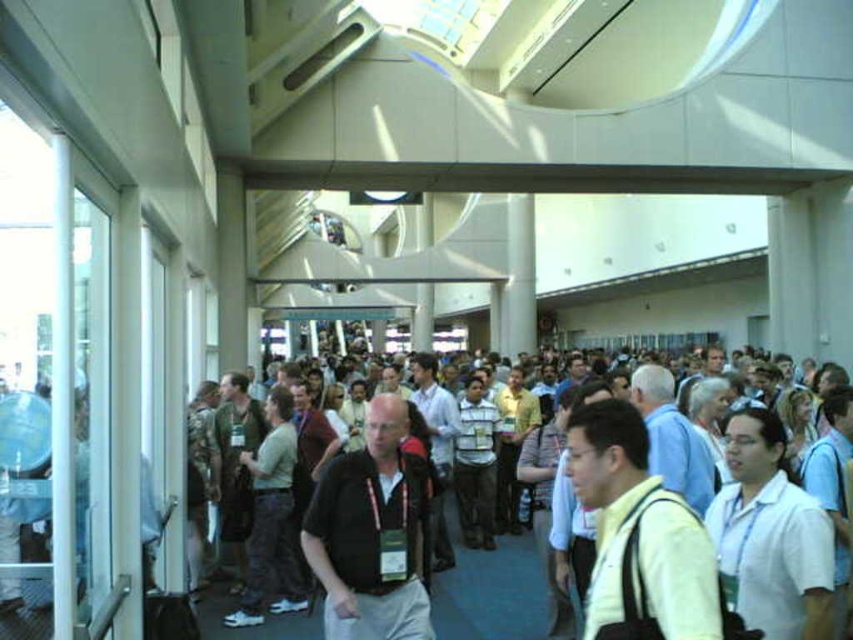
Who is more distant from viewer, (341,580) or (508,616)?

The point (508,616) is more distant.

Is matte black shirt at center positioned in front of light blue shirt at center?

Yes, it is in front of light blue shirt at center.

Between point (419, 579) and point (218, 605), which one is positioned in front?

Point (419, 579)

The width and height of the screenshot is (853, 640). I want to click on matte black shirt at center, so tap(370, 532).

Is yellow matte shirt at center positioned at the back of light blue shirt at center?

No.

Can you confirm if yellow matte shirt at center is positioned below light blue shirt at center?

Incorrect, yellow matte shirt at center is not positioned below light blue shirt at center.

Locate an element on the screen. yellow matte shirt at center is located at coordinates (639, 525).

Image resolution: width=853 pixels, height=640 pixels. I want to click on yellow matte shirt at center, so click(x=639, y=525).

Between matte black shirt at center and yellow matte shirt at center, which one appears on the right side from the viewer's perspective?

yellow matte shirt at center

Is matte black shirt at center thinner than yellow matte shirt at center?

No, matte black shirt at center is not thinner than yellow matte shirt at center.

At what (x,y) coordinates should I click in order to perform the action: click on matte black shirt at center. Please return your answer as a coordinate pair (x, y). This screenshot has width=853, height=640. Looking at the image, I should click on tap(370, 532).